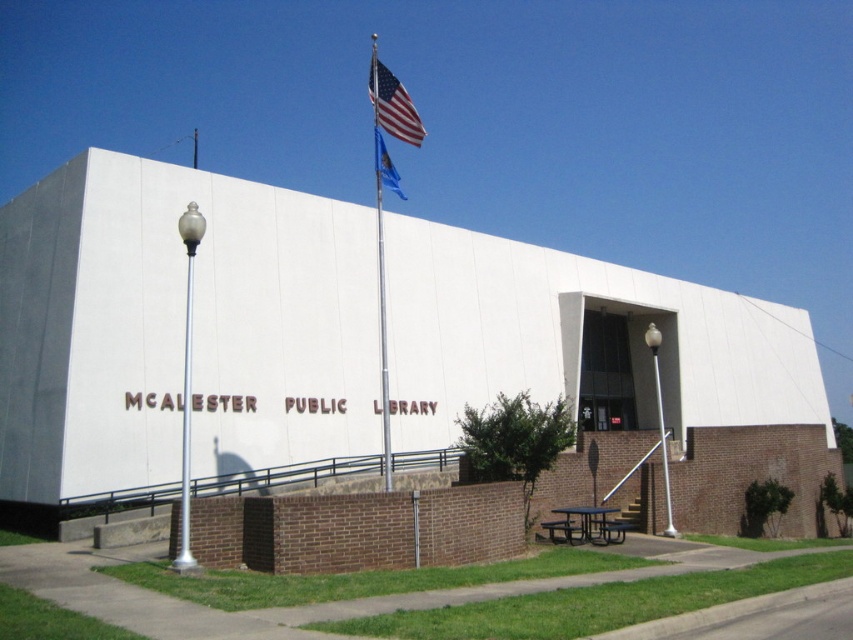
You are standing on the sidewalk in front of the McAlester Public Library. You see the silver metallic pole at left and the blue fabric flag at upper center. Which object is closer to you?

The silver metallic pole at left is closer to you because it is in front of the blue fabric flag at upper center.

You are a visitor approaching the McAlester Public Library and notice the silver metallic pole at left and the american flag at upper center. Which object is positioned higher from the ground?

The american flag at upper center is positioned higher from the ground than the silver metallic pole at left.

You are standing on the sidewalk in front of the McAlester Public Library. You see the silver metallic flag pole at upper center and the american flag at upper center. Which object is positioned lower from the ground?

The silver metallic flag pole at upper center is located below the american flag at upper center, so the flag pole is lower than the flag.